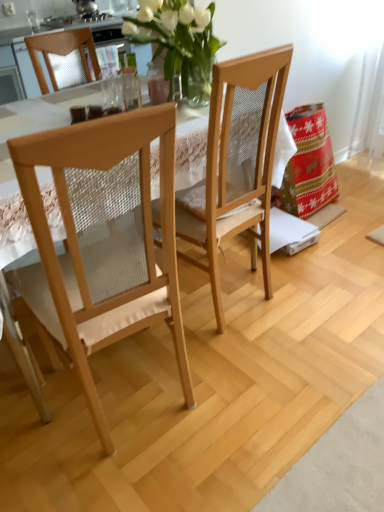
Question: Is light brown wood chair at center, which is the 2th chair from left to right, inside light wood/mesh chair at left, which is the 1th chair from left to right?

Choices:
 (A) no
 (B) yes

Answer: (A)

Question: Does light wood/mesh chair at left, which is the 1th chair from left to right, appear on the right side of light brown wood chair at center, which is the 2th chair from left to right?

Choices:
 (A) yes
 (B) no

Answer: (B)

Question: From the image's perspective, is light wood/mesh chair at left, which is the 1th chair from left to right, located beneath light brown wood chair at center, acting as the 1th chair starting from the right?

Choices:
 (A) no
 (B) yes

Answer: (B)

Question: From a real-world perspective, is light wood/mesh chair at left, which is the 1th chair from left to right, located beneath light brown wood chair at center, acting as the 1th chair starting from the right?

Choices:
 (A) no
 (B) yes

Answer: (B)

Question: Is light wood/mesh chair at left, the 2th chair when ordered from right to left, beside light brown wood chair at center, which is the 2th chair from left to right?

Choices:
 (A) yes
 (B) no

Answer: (B)

Question: Is light wood/mesh chair at left, the 2th chair when ordered from right to left, located outside light brown wood chair at center, which is the 2th chair from left to right?

Choices:
 (A) yes
 (B) no

Answer: (A)

Question: Is the position of light brown wood chair at center, acting as the 1th chair starting from the right, more distant than that of light wood/mesh chair at left, the 2th chair when ordered from right to left?

Choices:
 (A) yes
 (B) no

Answer: (A)

Question: From a real-world perspective, is light brown wood chair at center, which is the 2th chair from left to right, physically above light wood/mesh chair at left, which is the 1th chair from left to right?

Choices:
 (A) yes
 (B) no

Answer: (A)

Question: Is light brown wood chair at center, acting as the 1th chair starting from the right, beside light wood/mesh chair at left, the 2th chair when ordered from right to left?

Choices:
 (A) yes
 (B) no

Answer: (B)

Question: Does light brown wood chair at center, which is the 2th chair from left to right, have a lesser width compared to light wood/mesh chair at left, the 2th chair when ordered from right to left?

Choices:
 (A) no
 (B) yes

Answer: (B)

Question: Considering the relative sizes of light brown wood chair at center, acting as the 1th chair starting from the right, and light wood/mesh chair at left, the 2th chair when ordered from right to left, in the image provided, is light brown wood chair at center, acting as the 1th chair starting from the right, wider than light wood/mesh chair at left, the 2th chair when ordered from right to left,?

Choices:
 (A) yes
 (B) no

Answer: (B)

Question: Can you confirm if light brown wood chair at center, acting as the 1th chair starting from the right, is shorter than light wood/mesh chair at left, the 2th chair when ordered from right to left?

Choices:
 (A) yes
 (B) no

Answer: (B)

Question: Considering the positions of light wood/mesh chair at left, the 2th chair when ordered from right to left, and light brown wood chair at center, acting as the 1th chair starting from the right, in the image, is light wood/mesh chair at left, the 2th chair when ordered from right to left, taller or shorter than light brown wood chair at center, acting as the 1th chair starting from the right,?

Choices:
 (A) short
 (B) tall

Answer: (A)